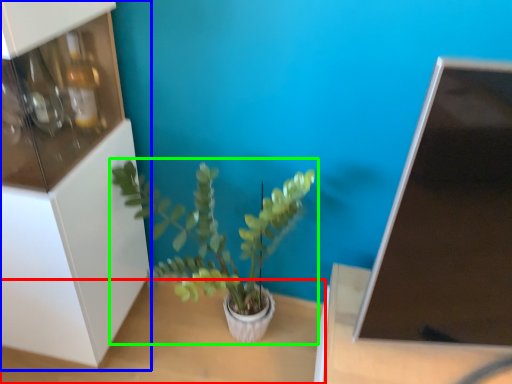
Question: Considering the real-world distances, which object is farthest from table (highlighted by a red box)? shelf (highlighted by a blue box) or houseplant (highlighted by a green box)?

Choices:
 (A) shelf
 (B) houseplant

Answer: (A)